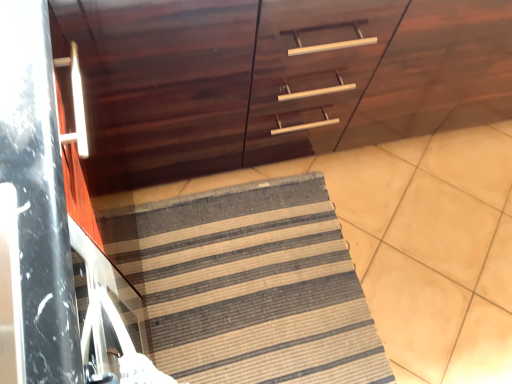
Where is `dark wood cabinet at center`? The width and height of the screenshot is (512, 384). dark wood cabinet at center is located at coordinates (275, 79).

The width and height of the screenshot is (512, 384). What do you see at coordinates (275, 79) in the screenshot?
I see `dark wood cabinet at center` at bounding box center [275, 79].

Locate an element on the screen. The width and height of the screenshot is (512, 384). dark wood cabinet at center is located at coordinates (275, 79).